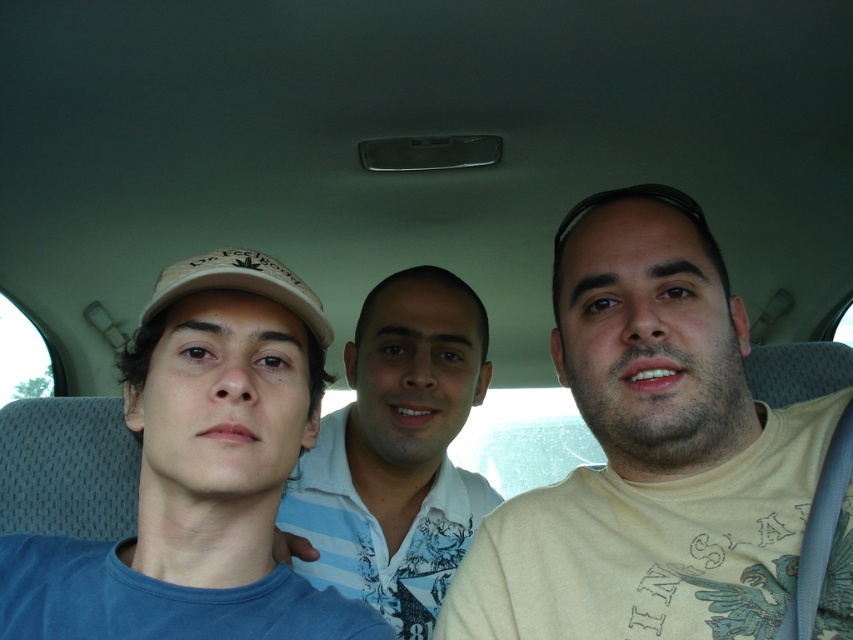
Who is shorter, white striped shirt at center or white matte baseball cap at center?

Standing shorter between the two is white matte baseball cap at center.

Which is more to the right, white striped shirt at center or white matte baseball cap at center?

From the viewer's perspective, white striped shirt at center appears more on the right side.

Where is `white striped shirt at center`? This screenshot has height=640, width=853. white striped shirt at center is located at coordinates (397, 452).

This screenshot has width=853, height=640. What are the coordinates of `white striped shirt at center` in the screenshot? It's located at (397, 452).

Who is more forward, (x=35, y=554) or (x=332, y=456)?

Point (x=35, y=554)

Does point (154, 460) lie in front of point (410, 616)?

Yes.

Is point (299, 340) more distant than point (310, 541)?

No, it is not.

Identify the location of blue cotton shirt at left. The image size is (853, 640). (199, 474).

Who is shorter, beige cotton shirt at center or white matte baseball cap at center?

With less height is white matte baseball cap at center.

Consider the image. Does beige cotton shirt at center have a lesser width compared to white matte baseball cap at center?

In fact, beige cotton shirt at center might be wider than white matte baseball cap at center.

Does point (767, 484) lie behind point (308, 310)?

Yes, it is.

Locate an element on the screen. This screenshot has height=640, width=853. beige cotton shirt at center is located at coordinates (650, 452).